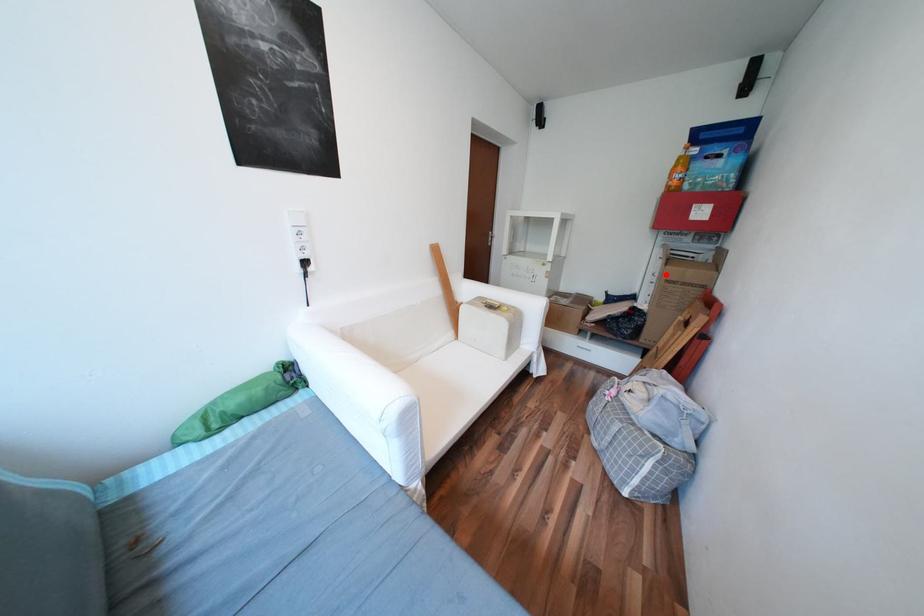
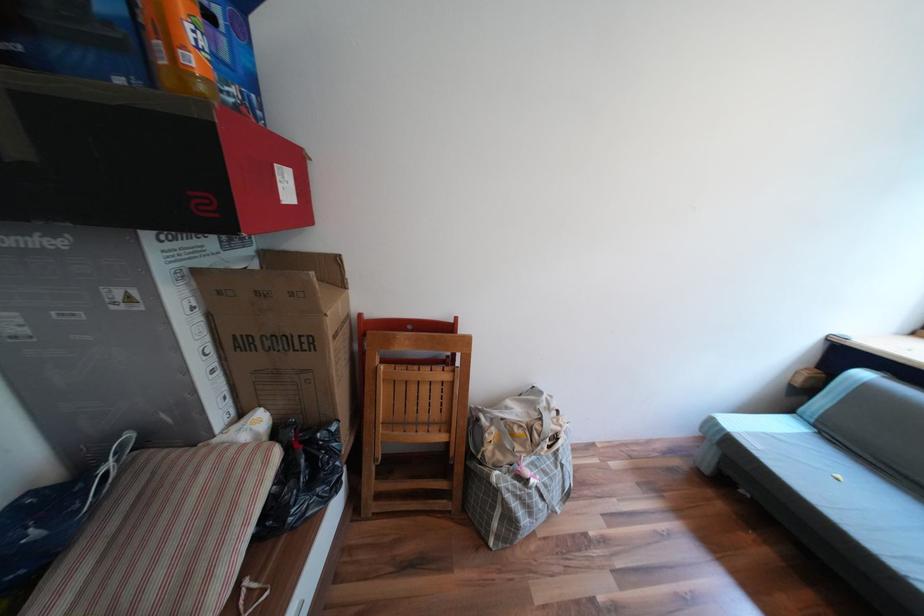
The point at the highlighted location is marked in the first image. Where is the corresponding point in the second image?

(219, 349)